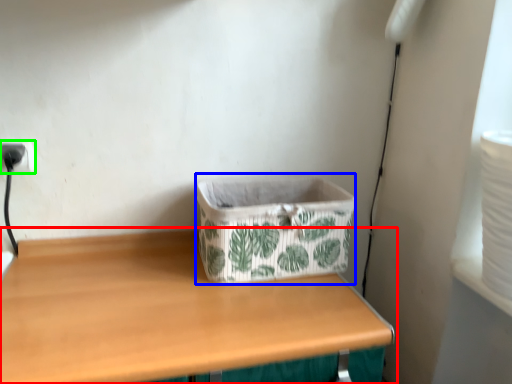
Question: Considering the real-world distances, which object is closest to table (highlighted by a red box)? storage box (highlighted by a blue box) or electric outlet (highlighted by a green box).

Choices:
 (A) storage box
 (B) electric outlet

Answer: (A)